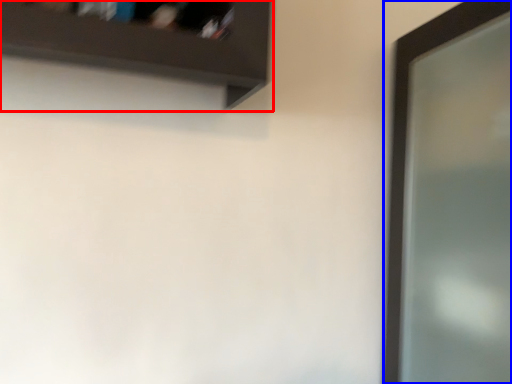
Question: Which object appears closest to the camera in this image, shelf (highlighted by a red box) or screen door (highlighted by a blue box)?

Choices:
 (A) shelf
 (B) screen door

Answer: (A)